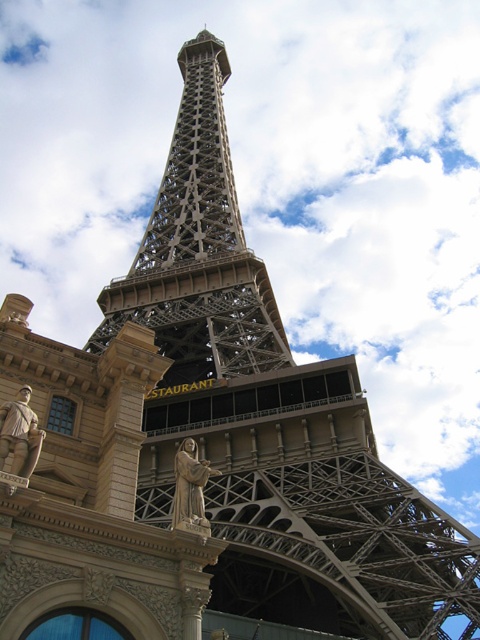
Which is more to the left, metallic gray eiffel tower at center or stone statue at center?

metallic gray eiffel tower at center

Can you confirm if metallic gray eiffel tower at center is positioned to the left of stone statue at center?

Yes, metallic gray eiffel tower at center is to the left of stone statue at center.

Which is behind, point (202, 259) or point (186, 468)?

Point (202, 259)

At what (x,y) coordinates should I click in order to perform the action: click on metallic gray eiffel tower at center. Please return your answer as a coordinate pair (x, y). Looking at the image, I should click on (199, 248).

Describe the element at coordinates (20, 435) in the screenshot. The width and height of the screenshot is (480, 640). I see `polished bronze statue at lower left` at that location.

Is polished bronze statue at lower left wider than stone statue at center?

No, polished bronze statue at lower left is not wider than stone statue at center.

Locate an element on the screen. The height and width of the screenshot is (640, 480). polished bronze statue at lower left is located at coordinates (20, 435).

Is metallic gray eiffel tower at center smaller than polished bronze statue at lower left?

No.

Is metallic gray eiffel tower at center shorter than polished bronze statue at lower left?

No.

Is point (183, 118) in front of point (19, 476)?

No, (183, 118) is further to viewer.

The image size is (480, 640). In order to click on metallic gray eiffel tower at center in this screenshot , I will do `click(199, 248)`.